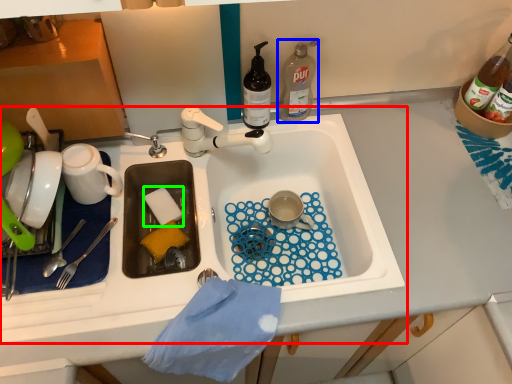
Question: Which object is the closest to the sink (highlighted by a red box)? Choose among these: bottle (highlighted by a blue box) or food (highlighted by a green box).

Choices:
 (A) bottle
 (B) food

Answer: (A)